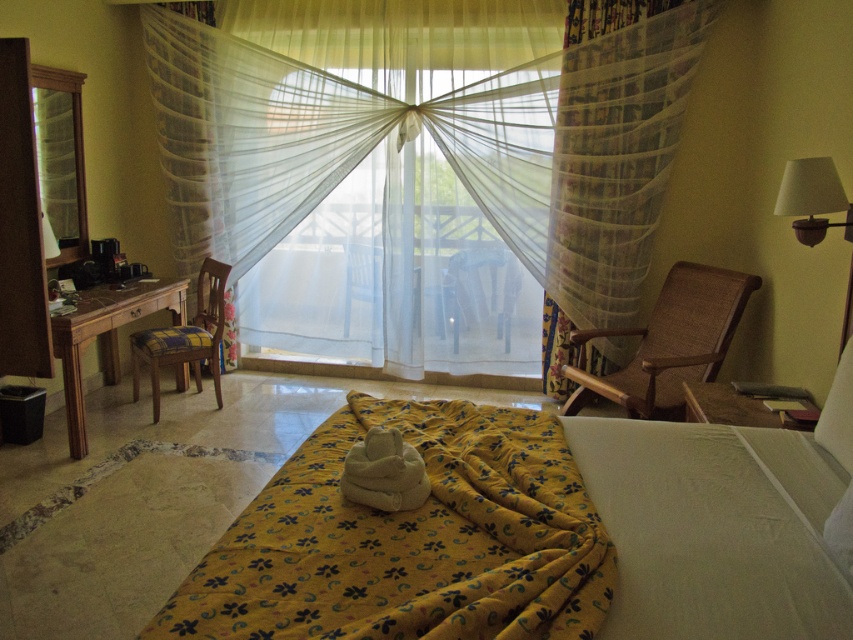
You are standing in the bedroom and want to see outside through the transparent fabric screen door at left. However, the yellow floral fabric blanket at center is blocking your view. Can you move the blanket to the side to get a clear view?

The yellow floral fabric blanket at center is in front of the transparent fabric screen door at left, so moving it aside would allow you to see through the door.

You are organizing a small party in the bedroom and need to place a new decorative item. You have a small statue that needs to be placed on a surface. Which object between the plaid fabric chair at left and the white fabric lampshade at upper right would be a suitable surface for placing the statue?

The plaid fabric chair at left is a suitable surface because it is below the white fabric lampshade at upper right and likely has a flat area where the statue can be placed.